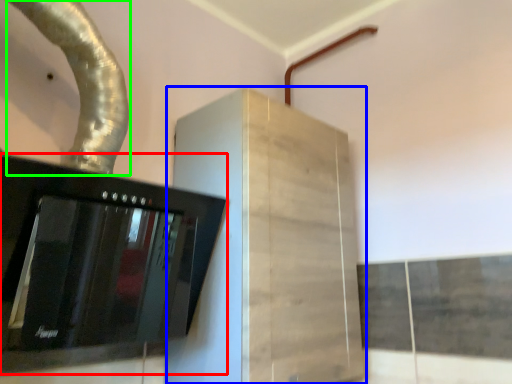
Question: Estimate the real-world distances between objects in this image. Which object is closer to home appliance (highlighted by a red box), cabinetry (highlighted by a blue box) or water pipe (highlighted by a green box)?

Choices:
 (A) cabinetry
 (B) water pipe

Answer: (A)